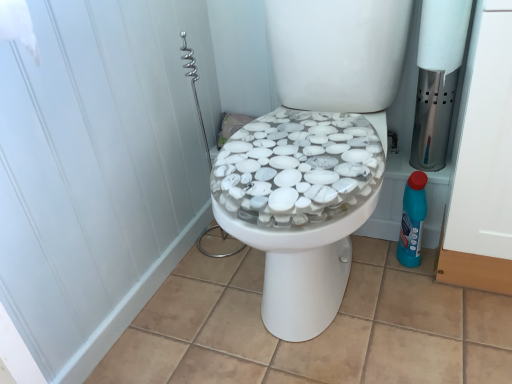
Locate an element on the screen. blue plastic bottle at right is located at coordinates (412, 220).

The image size is (512, 384). What do you see at coordinates (443, 35) in the screenshot?
I see `white matte toilet paper at upper right` at bounding box center [443, 35].

Locate an element on the screen. white matte toilet paper at upper right is located at coordinates (443, 35).

Identify the location of white matte screen door at upper left. The height and width of the screenshot is (384, 512). (98, 170).

Where is `blue plastic bottle at right`? Image resolution: width=512 pixels, height=384 pixels. blue plastic bottle at right is located at coordinates (412, 220).

Is white matte toilet paper at upper right far from white matte screen door at upper left?

They are positioned close to each other.

Based on the photo, is white matte toilet paper at upper right to the right of white matte screen door at upper left from the viewer's perspective?

Yes.

Is white matte toilet paper at upper right positioned beyond the bounds of white matte screen door at upper left?

Absolutely, white matte toilet paper at upper right is external to white matte screen door at upper left.

Is white matte toilet paper at upper right looking in the opposite direction of white matte screen door at upper left?

No, white matte screen door at upper left is not at the back of white matte toilet paper at upper right.

Is white matte screen door at upper left smaller than blue plastic bottle at right?

No.

Which is behind, point (132, 108) or point (399, 251)?

The point (399, 251) is more distant.

How different are the orientations of white matte screen door at upper left and blue plastic bottle at right in degrees?

The angle between the facing direction of white matte screen door at upper left and the facing direction of blue plastic bottle at right is 89.3 degrees.

Which object is closer to the camera, white matte screen door at upper left or blue plastic bottle at right?

white matte screen door at upper left is closer to the camera.

Is white matte screen door at upper left beside white matte toilet paper at upper right?

No, white matte screen door at upper left is not in contact with white matte toilet paper at upper right.

Can you confirm if white matte screen door at upper left is positioned to the left of white matte toilet paper at upper right?

Correct, you'll find white matte screen door at upper left to the left of white matte toilet paper at upper right.

Identify the location of toilet paper behind the white matte screen door at upper left. The image size is (512, 384). (443, 35).

Is white matte toilet paper at upper right completely or partially inside white matte screen door at upper left?

No, white matte toilet paper at upper right is not a part of white matte screen door at upper left.

In terms of width, does white matte toilet paper at upper right look wider or thinner when compared to blue plastic bottle at right?

Clearly, white matte toilet paper at upper right has more width compared to blue plastic bottle at right.

Is white matte toilet paper at upper right bigger or smaller than blue plastic bottle at right?

white matte toilet paper at upper right is bigger than blue plastic bottle at right.

Which is in front, point (468, 10) or point (412, 178)?

The point (468, 10) is closer.

Between point (415, 227) and point (106, 258), which one is positioned in front?

Point (106, 258)

Considering the relative positions of blue plastic bottle at right and white matte screen door at upper left in the image provided, is blue plastic bottle at right to the right of white matte screen door at upper left from the viewer's perspective?

Yes, blue plastic bottle at right is to the right of white matte screen door at upper left.

Locate an element on the screen. cleaning product behind the white matte screen door at upper left is located at coordinates (412, 220).

Is blue plastic bottle at right wider than white matte screen door at upper left?

Correct, the width of blue plastic bottle at right exceeds that of white matte screen door at upper left.

Based on the photo, from a real-world perspective, who is located lower, blue plastic bottle at right or white matte toilet paper at upper right?

blue plastic bottle at right.

Is blue plastic bottle at right oriented away from white matte toilet paper at upper right?

blue plastic bottle at right does not have its back to white matte toilet paper at upper right.

Which object is positioned more to the left, blue plastic bottle at right or white matte toilet paper at upper right?

blue plastic bottle at right.

Consider the image. Which object is closer to the camera, blue plastic bottle at right or white matte toilet paper at upper right?

white matte toilet paper at upper right is closer to the camera.

Image resolution: width=512 pixels, height=384 pixels. What are the coordinates of `toilet paper above the white matte screen door at upper left (from the image's perspective)` in the screenshot? It's located at (x=443, y=35).

I want to click on cleaning product behind the white matte screen door at upper left, so click(412, 220).

When comparing their distances from blue plastic bottle at right, does white matte screen door at upper left or white matte toilet paper at upper right seem closer?

white matte toilet paper at upper right is closer to blue plastic bottle at right.

Based on their spatial positions, is white matte toilet paper at upper right or white matte screen door at upper left further from blue plastic bottle at right?

Among the two, white matte screen door at upper left is located further to blue plastic bottle at right.

Based on their spatial positions, is blue plastic bottle at right or white matte screen door at upper left further from white matte toilet paper at upper right?

Based on the image, white matte screen door at upper left appears to be further to white matte toilet paper at upper right.

Which object lies further to the anchor point white matte screen door at upper left, white matte toilet paper at upper right or blue plastic bottle at right?

Among the two, white matte toilet paper at upper right is located further to white matte screen door at upper left.

Considering their positions, is blue plastic bottle at right positioned closer to white matte screen door at upper left than white matte toilet paper at upper right?

blue plastic bottle at right is closer to white matte screen door at upper left.

From the image, which object appears to be farther from white matte toilet paper at upper right, white matte screen door at upper left or blue plastic bottle at right?

The object further to white matte toilet paper at upper right is white matte screen door at upper left.

In order to click on cleaning product between white matte screen door at upper left and white matte toilet paper at upper right in the horizontal direction in this screenshot , I will do `click(412, 220)`.